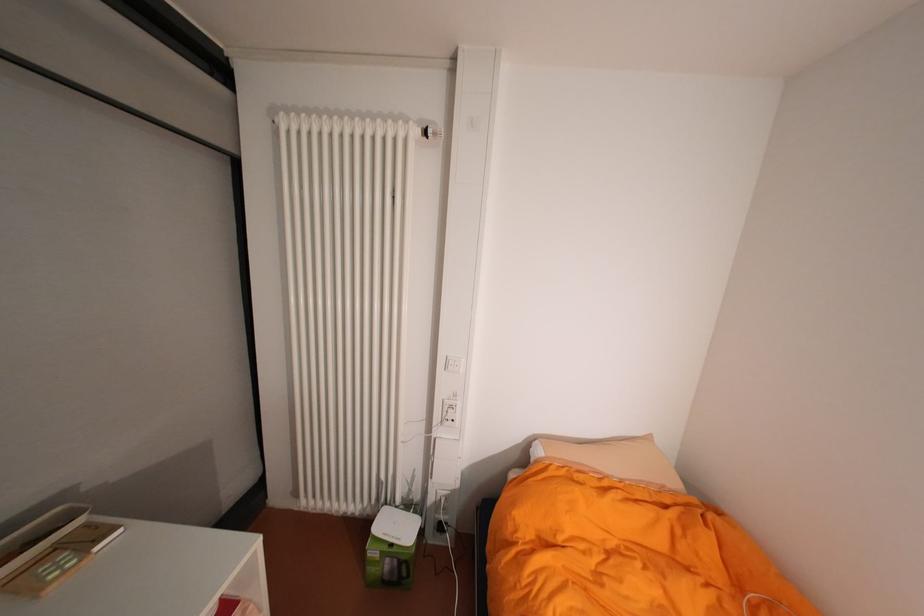
Find the location of a particular element. white radiator knob is located at coordinates (432, 132).